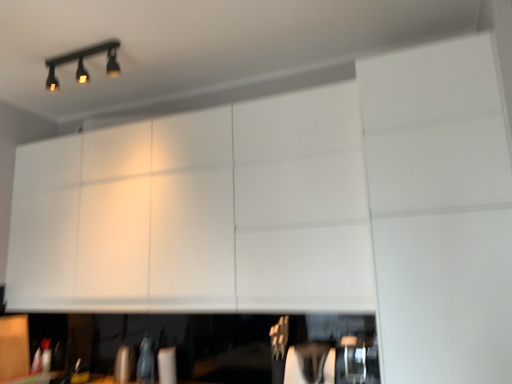
Question: Is white matte cabinet at upper center, which is the 1th cabinetry in right-to-left order, at the left side of black matte track light at upper left?

Choices:
 (A) no
 (B) yes

Answer: (A)

Question: From a real-world perspective, is white matte cabinet at upper center, positioned as the first cabinetry in top-to-bottom order, positioned under black matte track light at upper left based on gravity?

Choices:
 (A) no
 (B) yes

Answer: (B)

Question: Does white matte cabinet at upper center, positioned as the first cabinetry in top-to-bottom order, have a greater width compared to black matte track light at upper left?

Choices:
 (A) yes
 (B) no

Answer: (A)

Question: Can you confirm if white matte cabinet at upper center, the second cabinetry when ordered from bottom to top, is shorter than black matte track light at upper left?

Choices:
 (A) no
 (B) yes

Answer: (A)

Question: From the image's perspective, is white matte cabinet at upper center, the second cabinetry when ordered from bottom to top, located above black matte track light at upper left?

Choices:
 (A) no
 (B) yes

Answer: (A)

Question: Does white matte cabinet at upper center, positioned as the first cabinetry in top-to-bottom order, lie in front of black matte track light at upper left?

Choices:
 (A) yes
 (B) no

Answer: (A)

Question: From the image's perspective, is white matte cabinet at upper center, the second cabinetry in the left-to-right sequence, located beneath matte wood cabinet at lower left, acting as the 2th cabinetry starting from the right?

Choices:
 (A) no
 (B) yes

Answer: (A)

Question: From a real-world perspective, is white matte cabinet at upper center, the second cabinetry when ordered from bottom to top, on matte wood cabinet at lower left, which is the 1th cabinetry in left-to-right order?

Choices:
 (A) yes
 (B) no

Answer: (A)

Question: Is white matte cabinet at upper center, the second cabinetry in the left-to-right sequence, positioned with its back to matte wood cabinet at lower left, which is the 1th cabinetry in left-to-right order?

Choices:
 (A) yes
 (B) no

Answer: (B)

Question: Is white matte cabinet at upper center, positioned as the first cabinetry in top-to-bottom order, thinner than matte wood cabinet at lower left, which ranks as the 2th cabinetry in top-to-bottom order?

Choices:
 (A) no
 (B) yes

Answer: (A)

Question: From the image's perspective, is white matte cabinet at upper center, the second cabinetry in the left-to-right sequence, above matte wood cabinet at lower left, which ranks as the 2th cabinetry in top-to-bottom order?

Choices:
 (A) no
 (B) yes

Answer: (B)

Question: Is white matte cabinet at upper center, the second cabinetry when ordered from bottom to top, far away from matte wood cabinet at lower left, which is the 1th cabinetry in left-to-right order?

Choices:
 (A) yes
 (B) no

Answer: (A)

Question: Is black matte track light at upper left aimed at white matte cabinet at upper center, the second cabinetry in the left-to-right sequence?

Choices:
 (A) no
 (B) yes

Answer: (A)